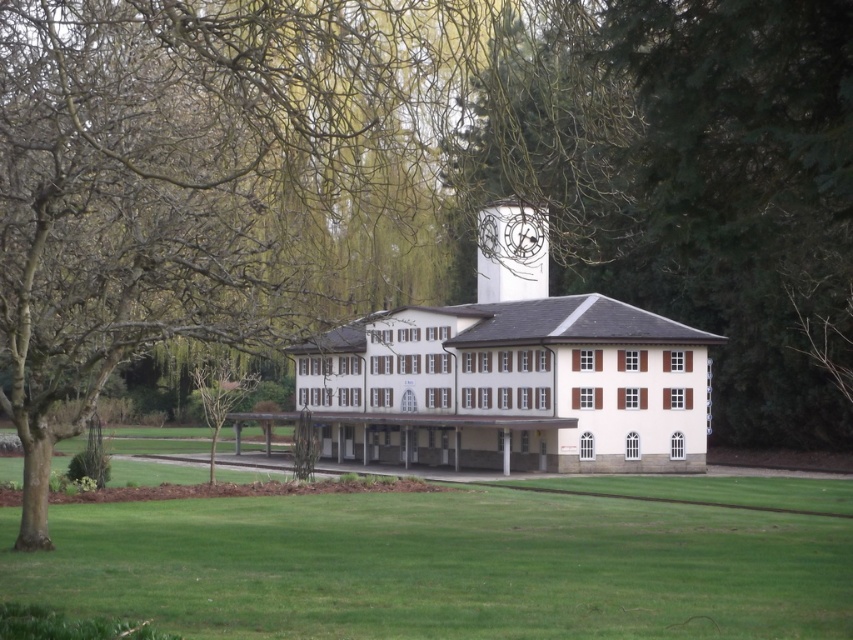
Question: Where is green grass at center located in relation to white painted clock at center in the image?

Choices:
 (A) right
 (B) left

Answer: (B)

Question: Can you confirm if green grass at center is thinner than white painted clock at center?

Choices:
 (A) no
 (B) yes

Answer: (A)

Question: Considering the relative positions of green grass at center and white painted clock at center in the image provided, where is green grass at center located with respect to white painted clock at center?

Choices:
 (A) above
 (B) below

Answer: (B)

Question: Which point is closer to the camera?

Choices:
 (A) white painted clock at center
 (B) green grass at center

Answer: (B)

Question: Which of the following is the closest to the observer?

Choices:
 (A) white painted clock at center
 (B) green grass at center

Answer: (B)